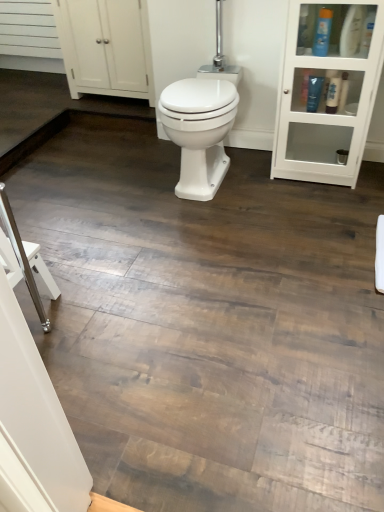
Measure the distance between blue plastic bottle at upper right, the second toiletry when ordered from left to right, and camera.

The distance of blue plastic bottle at upper right, the second toiletry when ordered from left to right, from camera is 6.18 feet.

Consider the image. In order to face white glass cabinet at upper right, should I rotate leftwards or rightwards?

Turn right approximately 17.273 degrees to face it.

Image resolution: width=384 pixels, height=512 pixels. I want to click on white glossy bidet at center, so click(199, 132).

Find the location of a particular element. blue plastic bottle at upper right, which is counted as the second toiletry, starting from the right is located at coordinates (323, 32).

Considering the sizes of objects white glossy bidet at center and shiny black tube at upper right, placed as the 1th toiletry when sorted from left to right, in the image provided, who is shorter, white glossy bidet at center or shiny black tube at upper right, placed as the 1th toiletry when sorted from left to right,?

With less height is shiny black tube at upper right, placed as the 1th toiletry when sorted from left to right.

Which is closer, (197, 190) or (308, 109)?

The point (197, 190) is closer to the camera.

Is white glossy bidet at center far away from shiny black tube at upper right, arranged as the third toiletry when viewed from the right?

Actually, white glossy bidet at center and shiny black tube at upper right, arranged as the third toiletry when viewed from the right, are a little close together.

Is blue plastic bottle at upper right, which appears as the third toiletry when viewed from the left, surrounded by white glass cabinet at upper right?

Yes, blue plastic bottle at upper right, which appears as the third toiletry when viewed from the left, is surrounded by white glass cabinet at upper right.

Based on their sizes in the image, would you say white glass cabinet at upper right is bigger or smaller than blue plastic bottle at upper right, which appears as the third toiletry when viewed from the left?

Considering their sizes, white glass cabinet at upper right takes up more space than blue plastic bottle at upper right, which appears as the third toiletry when viewed from the left.

Find the location of a particular element. The height and width of the screenshot is (512, 384). the 1st toiletry behind when counting from the white glass cabinet at upper right is located at coordinates (352, 31).

From a real-world perspective, between white glass cabinet at upper right and blue plastic bottle at upper right, which appears as the third toiletry when viewed from the left, who is vertically lower?

white glass cabinet at upper right, from a real-world perspective.

Considering the sizes of objects blue plastic bottle at upper right, arranged as the 1th toiletry when viewed from the right, and white matte cabinet at upper left in the image provided, who is bigger, blue plastic bottle at upper right, arranged as the 1th toiletry when viewed from the right, or white matte cabinet at upper left?

white matte cabinet at upper left is bigger.

From the image's perspective, is blue plastic bottle at upper right, which appears as the third toiletry when viewed from the left, below white matte cabinet at upper left?

Yes, from the image's perspective, blue plastic bottle at upper right, which appears as the third toiletry when viewed from the left, is below white matte cabinet at upper left.

Which object is more forward, blue plastic bottle at upper right, which appears as the third toiletry when viewed from the left, or white matte cabinet at upper left?

blue plastic bottle at upper right, which appears as the third toiletry when viewed from the left, is closer to the camera.

Which is closer, (356, 20) or (66, 23)?

The point (356, 20) is more forward.

From the image's perspective, which one is positioned higher, blue plastic bottle at upper right, which appears as the third toiletry when viewed from the left, or white glossy bidet at center?

From the image's view, blue plastic bottle at upper right, which appears as the third toiletry when viewed from the left, is above.

Considering the positions of objects blue plastic bottle at upper right, arranged as the 1th toiletry when viewed from the right, and white glossy bidet at center in the image provided, who is behind, blue plastic bottle at upper right, arranged as the 1th toiletry when viewed from the right, or white glossy bidet at center?

white glossy bidet at center is behind.

Can you tell me how much blue plastic bottle at upper right, arranged as the 1th toiletry when viewed from the right, and white glossy bidet at center differ in facing direction?

blue plastic bottle at upper right, arranged as the 1th toiletry when viewed from the right, and white glossy bidet at center are facing 48.7 degrees away from each other.

Does point (342, 29) appear closer or farther from the camera than point (172, 130)?

Point (342, 29) appears to be farther away from the viewer than point (172, 130).

Considering the relative positions of blue plastic bottle at upper right, which is counted as the second toiletry, starting from the right, and blue plastic bottle at upper right, arranged as the 1th toiletry when viewed from the right, in the image provided, is blue plastic bottle at upper right, which is counted as the second toiletry, starting from the right, behind blue plastic bottle at upper right, arranged as the 1th toiletry when viewed from the right,?

Yes, it is behind blue plastic bottle at upper right, arranged as the 1th toiletry when viewed from the right.

Could you tell me if blue plastic bottle at upper right, the second toiletry when ordered from left to right, is turned towards blue plastic bottle at upper right, which appears as the third toiletry when viewed from the left?

No, blue plastic bottle at upper right, the second toiletry when ordered from left to right, does not turn towards blue plastic bottle at upper right, which appears as the third toiletry when viewed from the left.

Can you confirm if blue plastic bottle at upper right, the second toiletry when ordered from left to right, is smaller than blue plastic bottle at upper right, arranged as the 1th toiletry when viewed from the right?

Indeed, blue plastic bottle at upper right, the second toiletry when ordered from left to right, has a smaller size compared to blue plastic bottle at upper right, arranged as the 1th toiletry when viewed from the right.

Between blue plastic bottle at upper right, which is counted as the second toiletry, starting from the right, and blue plastic bottle at upper right, which appears as the third toiletry when viewed from the left, which one has smaller width?

blue plastic bottle at upper right, which appears as the third toiletry when viewed from the left, is thinner.

From a real-world perspective, which toiletry is the 2nd one above the white glass cabinet at upper right? Please provide its 2D coordinates.

[(323, 32)]

Is white glass cabinet at upper right shorter than blue plastic bottle at upper right, which is counted as the second toiletry, starting from the right?

No.

From a real-world perspective, does white glass cabinet at upper right sit lower than blue plastic bottle at upper right, which is counted as the second toiletry, starting from the right?

Yes.

Consider the image. From the image's perspective, is white glass cabinet at upper right above or below blue plastic bottle at upper right, the second toiletry when ordered from left to right?

white glass cabinet at upper right is situated lower than blue plastic bottle at upper right, the second toiletry when ordered from left to right, in the image.

Image resolution: width=384 pixels, height=512 pixels. I want to click on the 2nd toiletry in front of the white matte cabinet at upper left, counting from the anchor's position, so click(323, 32).

What's the angular difference between blue plastic bottle at upper right, the second toiletry when ordered from left to right, and white matte cabinet at upper left's facing directions?

The angle between the facing direction of blue plastic bottle at upper right, the second toiletry when ordered from left to right, and the facing direction of white matte cabinet at upper left is 15.7 degrees.

Who is bigger, blue plastic bottle at upper right, the second toiletry when ordered from left to right, or white matte cabinet at upper left?

white matte cabinet at upper left.

The height and width of the screenshot is (512, 384). Identify the location of the 1st toiletry counting from the right side of the white glossy bidet at center. (314, 93).

Where is `shelf lying below the blue plastic bottle at upper right, arranged as the 1th toiletry when viewed from the right (from the image's perspective)`? shelf lying below the blue plastic bottle at upper right, arranged as the 1th toiletry when viewed from the right (from the image's perspective) is located at coordinates coord(328,91).

From the picture: From the image, which object appears to be farther from blue plastic bottle at upper right, which is counted as the second toiletry, starting from the right, shiny black tube at upper right, placed as the 1th toiletry when sorted from left to right, or white matte cabinet at upper left?

The object further to blue plastic bottle at upper right, which is counted as the second toiletry, starting from the right, is white matte cabinet at upper left.

Considering their positions, is blue plastic bottle at upper right, arranged as the 1th toiletry when viewed from the right, positioned further to white glass cabinet at upper right than blue plastic bottle at upper right, which is counted as the second toiletry, starting from the right?

blue plastic bottle at upper right, which is counted as the second toiletry, starting from the right, lies further to white glass cabinet at upper right than the other object.

Looking at the image, which one is located closer to shiny black tube at upper right, arranged as the third toiletry when viewed from the right, white glass cabinet at upper right or white glossy bidet at center?

white glass cabinet at upper right.

Considering their positions, is shiny black tube at upper right, arranged as the third toiletry when viewed from the right, positioned closer to white matte cabinet at upper left than white glass cabinet at upper right?

The object closer to white matte cabinet at upper left is white glass cabinet at upper right.

Estimate the real-world distances between objects in this image. Which object is further from white glass cabinet at upper right, white glossy bidet at center or shiny black tube at upper right, placed as the 1th toiletry when sorted from left to right?

The object further to white glass cabinet at upper right is white glossy bidet at center.

When comparing their distances from white glass cabinet at upper right, does white glossy bidet at center or white matte cabinet at upper left seem closer?

white glossy bidet at center.

Based on their spatial positions, is white matte cabinet at upper left or white glass cabinet at upper right closer to white glossy bidet at center?

white glass cabinet at upper right.

Looking at the image, which one is located closer to white glass cabinet at upper right, white matte cabinet at upper left or blue plastic bottle at upper right, the second toiletry when ordered from left to right?

blue plastic bottle at upper right, the second toiletry when ordered from left to right.

Locate an element on the screen. shelf between white matte cabinet at upper left and blue plastic bottle at upper right, which appears as the third toiletry when viewed from the left, in the horizontal direction is located at coordinates (328, 91).

Find the location of a particular element. toiletry between blue plastic bottle at upper right, which appears as the third toiletry when viewed from the left, and shiny black tube at upper right, placed as the 1th toiletry when sorted from left to right, vertically is located at coordinates (323, 32).

Locate an element on the screen. The image size is (384, 512). bidet between white matte cabinet at upper left and white glass cabinet at upper right from left to right is located at coordinates (199, 132).

Identify the location of toiletry between white matte cabinet at upper left and blue plastic bottle at upper right, which is counted as the second toiletry, starting from the right, from left to right. (314, 93).